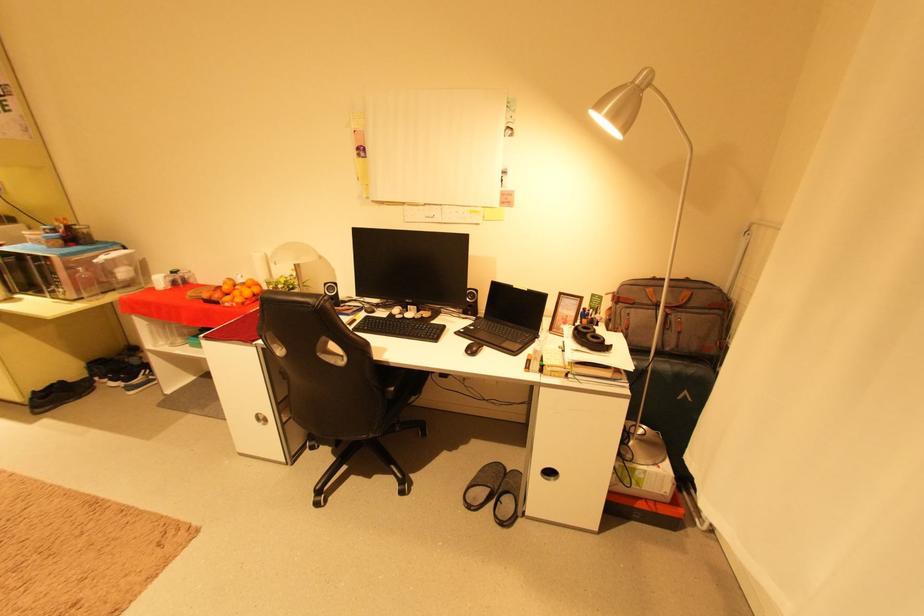
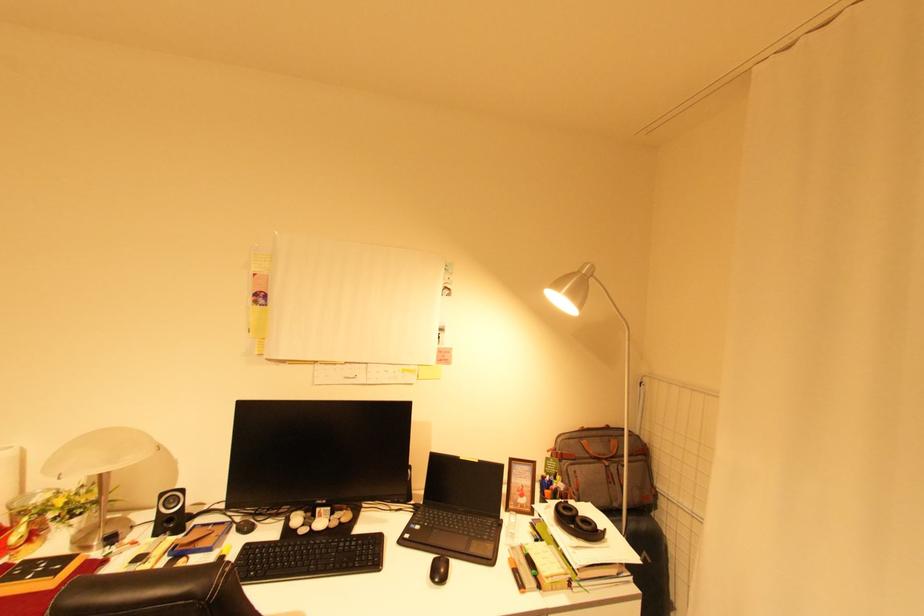
In the second image, find the point that corresponds to point (639, 83) in the first image.

(587, 273)